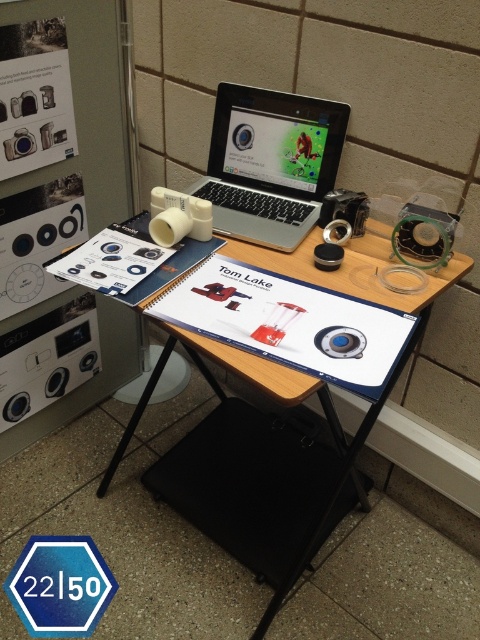
Question: Based on their relative distances, which object is farther from the black plastic speaker at center?

Choices:
 (A) silver metallic laptop at center
 (B) wooden table at center

Answer: (B)

Question: Which of these objects is positioned closest to the black plastic speaker at center?

Choices:
 (A) silver metallic laptop at center
 (B) blue hexagonal stop sign at center
 (C) wooden table at center

Answer: (A)

Question: Considering the relative positions of wooden table at center and black plastic speaker at center in the image provided, where is wooden table at center located with respect to black plastic speaker at center?

Choices:
 (A) right
 (B) left

Answer: (B)

Question: Among these objects, which one is farthest from the camera?

Choices:
 (A) black plastic speaker at center
 (B) wooden table at center
 (C) silver metallic laptop at center
 (D) blue hexagonal stop sign at center

Answer: (D)

Question: Does silver metallic laptop at center appear over blue hexagonal stop sign at center?

Choices:
 (A) yes
 (B) no

Answer: (A)

Question: Is wooden table at center to the right of silver metallic laptop at center from the viewer's perspective?

Choices:
 (A) no
 (B) yes

Answer: (A)